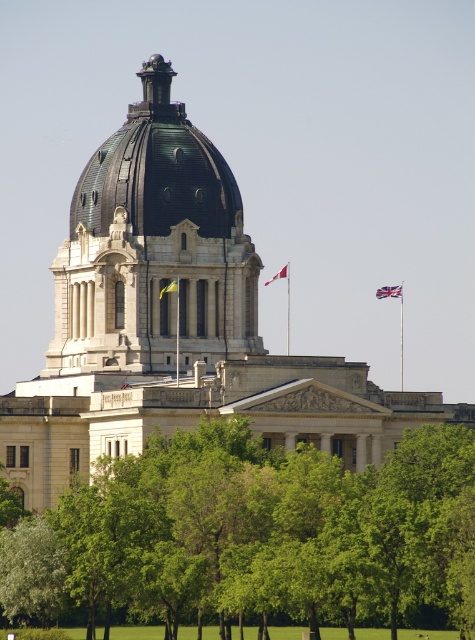
Question: Which of the following is the closest to the observer?

Choices:
 (A) british flag at upper right
 (B) red fabric flag at upper center

Answer: (A)

Question: Considering the relative positions of green leafy tree at center and yellow fabric flag at center in the image provided, where is green leafy tree at center located with respect to yellow fabric flag at center?

Choices:
 (A) below
 (B) above

Answer: (A)

Question: Is british flag at upper right above yellow fabric flag at center?

Choices:
 (A) no
 (B) yes

Answer: (B)

Question: Does british flag at upper right appear on the left side of red fabric flag at upper center?

Choices:
 (A) no
 (B) yes

Answer: (A)

Question: Among these objects, which one is nearest to the camera?

Choices:
 (A) red fabric flag at upper center
 (B) green leafy tree at center
 (C) british flag at upper right
 (D) green copper dome at center

Answer: (B)

Question: Considering the real-world distances, which object is closest to the red fabric flag at upper center?

Choices:
 (A) british flag at upper right
 (B) green leafy tree at center
 (C) yellow fabric flag at center
 (D) green copper dome at upper center

Answer: (A)